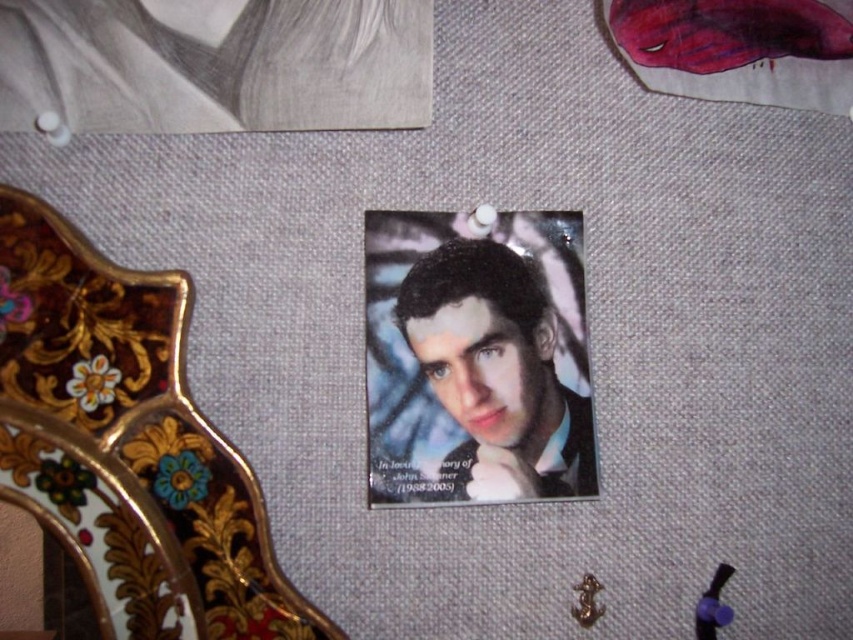
Can you confirm if gold painted wood at center is shorter than matte black portrait at center?

Incorrect, gold painted wood at center's height does not fall short of matte black portrait at center's.

Is point (109, 397) positioned in front of point (541, 481)?

Yes, point (109, 397) is closer to viewer.

The image size is (853, 640). Identify the location of gold painted wood at center. (126, 445).